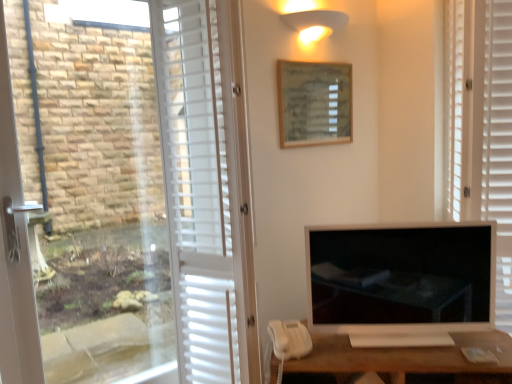
Where is `vacant space that is in between white matte corded phone at lower center and matte black monitor at center`? Image resolution: width=512 pixels, height=384 pixels. vacant space that is in between white matte corded phone at lower center and matte black monitor at center is located at coordinates (371, 345).